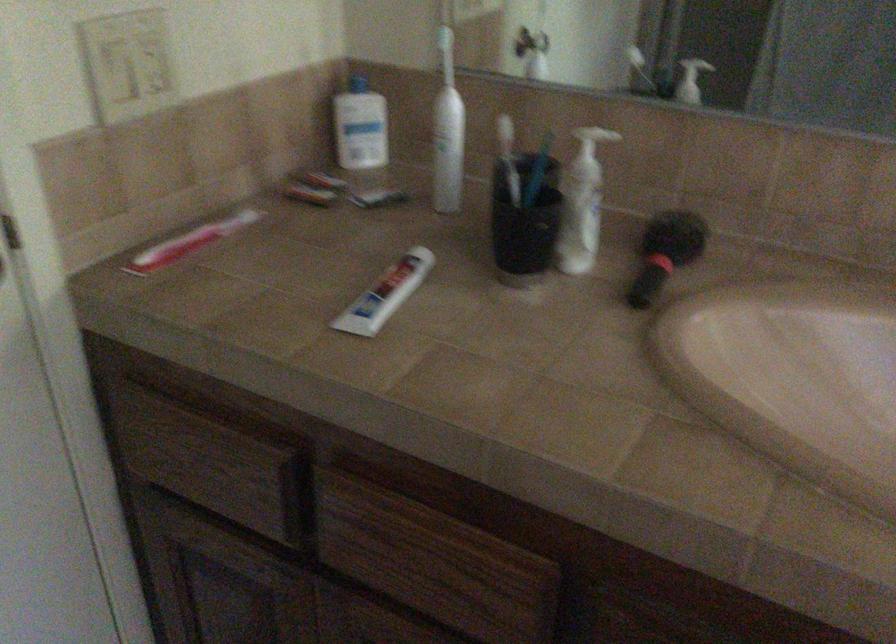
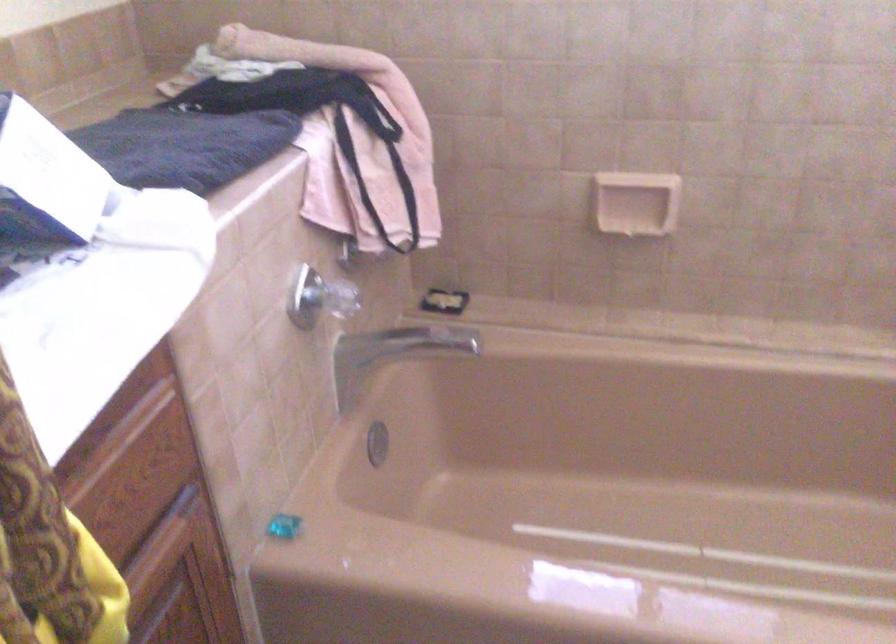
In the scene shown: First-person continuous shooting, in which direction is the camera rotating?

The camera's rotation is toward right-down.